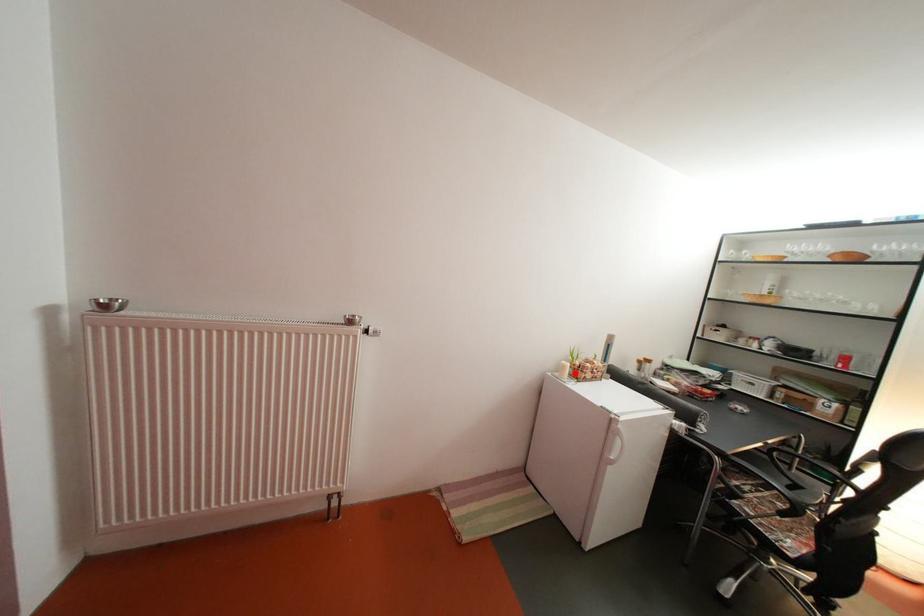
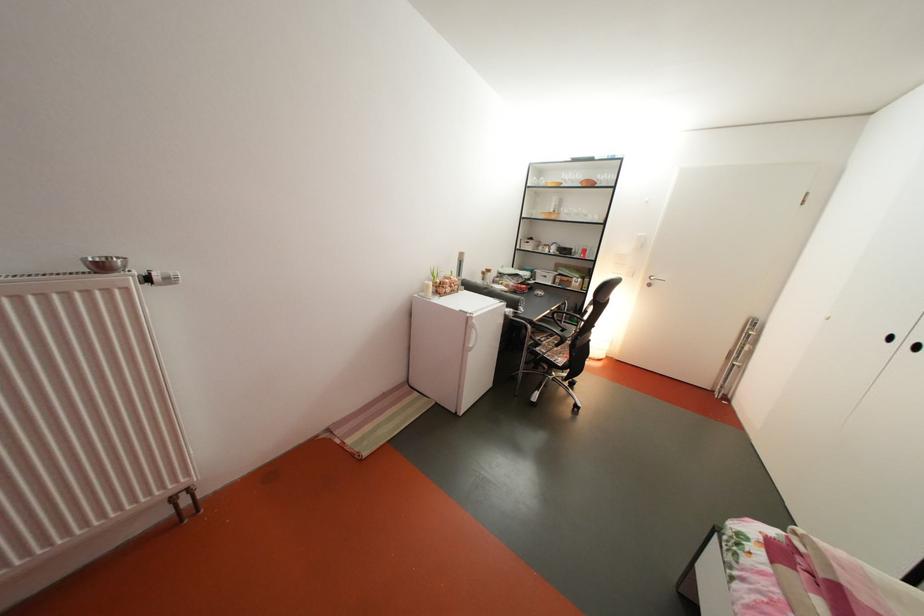
Question: A red point is marked in image1. In image2, is the corresponding 3D point closer to the camera or farther? Reply with the corresponding letter.

Choices:
 (A) The corresponding 3D point is closer.
 (B) The corresponding 3D point is farther.

Answer: (A)